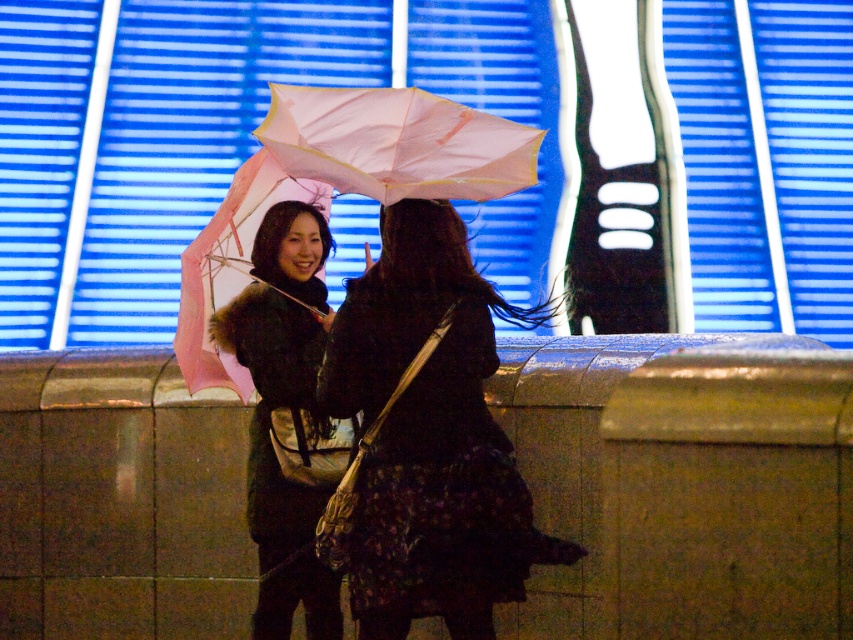
Question: Is floral-patterned fabric dress at center in front of pink matte umbrella at center?

Choices:
 (A) yes
 (B) no

Answer: (B)

Question: Can you confirm if concrete ledge at center is positioned to the left of pink matte umbrella at left?

Choices:
 (A) yes
 (B) no

Answer: (B)

Question: Is concrete ledge at center to the left of floral-patterned fabric dress at center from the viewer's perspective?

Choices:
 (A) yes
 (B) no

Answer: (A)

Question: Based on their relative distances, which object is farther from the concrete ledge at center?

Choices:
 (A) pink matte umbrella at center
 (B) matte black coat at center

Answer: (B)

Question: Which of the following is the closest to the observer?

Choices:
 (A) pink matte umbrella at center
 (B) concrete ledge at center
 (C) floral-patterned fabric dress at center

Answer: (B)

Question: Which of the following is the farthest from the observer?

Choices:
 (A) (387, 547)
 (B) (578, 573)

Answer: (B)